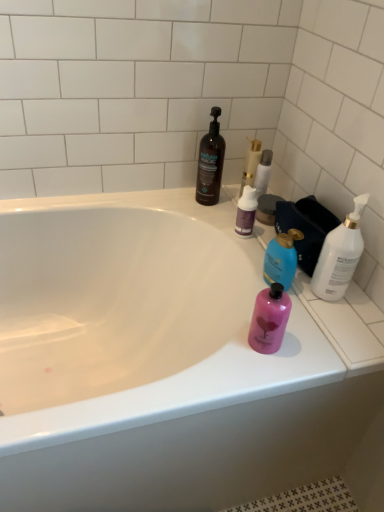
In order to click on free space in front of gold metallic candle at upper center in this screenshot , I will do `click(235, 219)`.